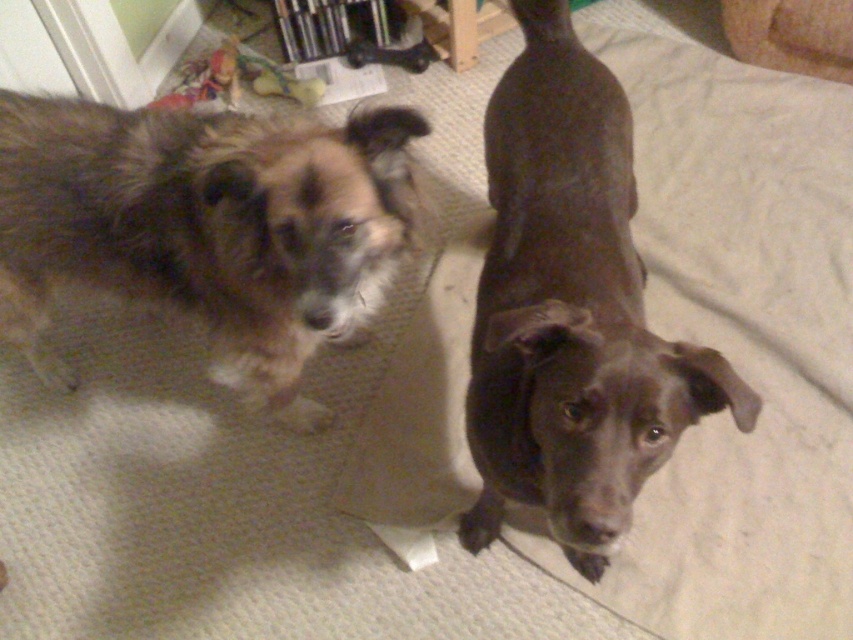
You are a dog trainer observing two dogs in a home. You need to determine the spatial relationship between the brown fuzzy dog at left and the shiny brown dog at center. Which dog is closer to you?

The brown fuzzy dog at left is closer to you because the shiny brown dog at center is positioned behind it.

You are standing in a room with two dogs. There is a point at coordinates point (x=225, y=164) that is 1.13 meters away from you. If you want to place a treat exactly at that point, which dog would be closer to the treat when you drop it?

The point (x=225, y=164) is 1.13 meters away from the viewer. Since the dogs are positioned at different locations in the room, the distance of each dog to the point would depend on their exact positions. However, without specific information about their distances from the point, it is impossible to determine which dog is closer.

You are a dog trainer observing the two dogs in the image. Which dog, the brown fuzzy dog at left or the shiny brown dog at center, is positioned higher up in the image?

The brown fuzzy dog at left is positioned higher up in the image than the shiny brown dog at center.